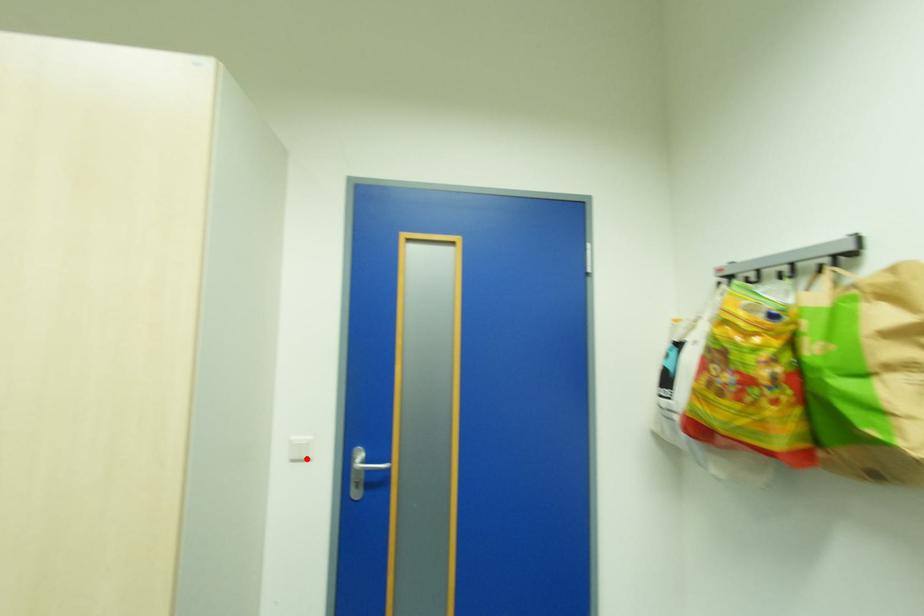
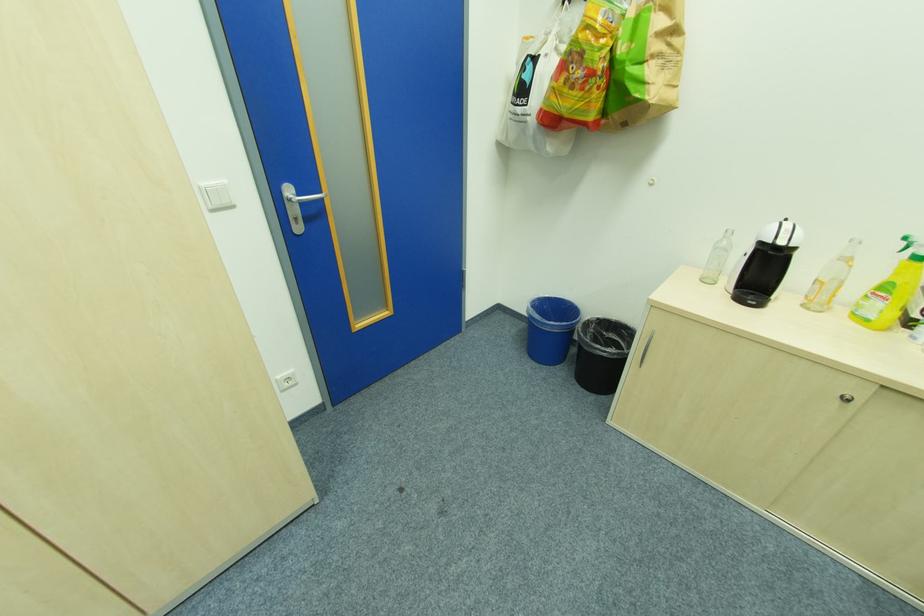
Find the pixel in the second image that matches the highlighted location in the first image.

(232, 204)